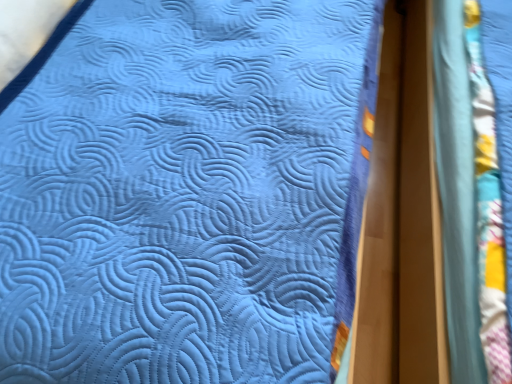
Describe the element at coordinates (473, 188) in the screenshot. I see `teal fabric curtain at right` at that location.

What is the approximate width of teal fabric curtain at right?

teal fabric curtain at right is 6.17 feet wide.

You are a GUI agent. You are given a task and a screenshot of the screen. Output one action in this format:
    pyautogui.click(x=<x>, y=<y>)
    Task: Click on the teal fabric curtain at right
    This screenshot has height=384, width=512.
    Given the screenshot: What is the action you would take?
    pyautogui.click(x=473, y=188)

What are the coordinates of `teal fabric curtain at right` in the screenshot? It's located at (473, 188).